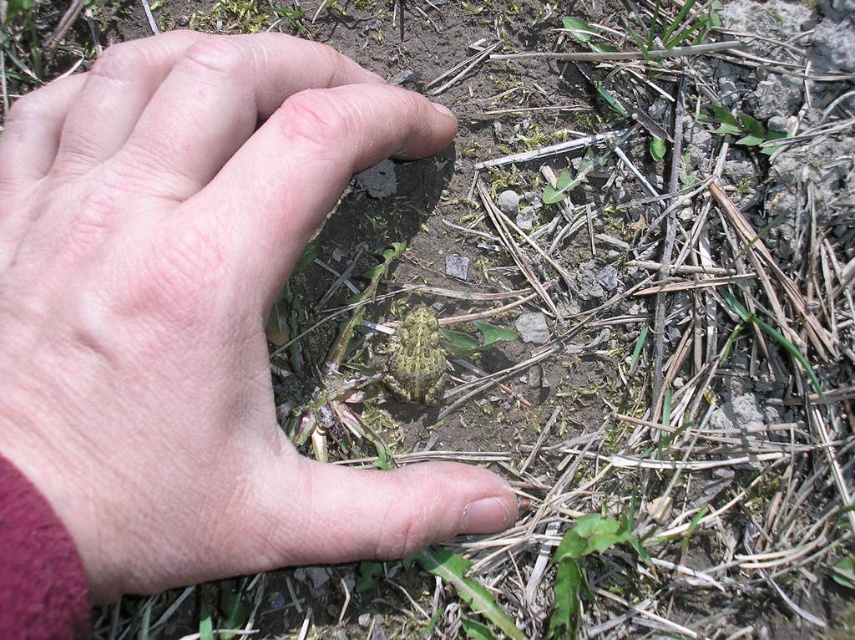
Question: Is pink flesh at center to the left of camouflage skin frog at center from the viewer's perspective?

Choices:
 (A) no
 (B) yes

Answer: (B)

Question: Which object appears farthest from the camera in this image?

Choices:
 (A) camouflage skin frog at center
 (B) pink flesh at center

Answer: (A)

Question: Which of the following is the closest to the observer?

Choices:
 (A) (381, 362)
 (B) (196, 198)

Answer: (B)

Question: Is pink flesh at center to the right of camouflage skin frog at center from the viewer's perspective?

Choices:
 (A) no
 (B) yes

Answer: (A)

Question: Is pink flesh at center bigger than camouflage skin frog at center?

Choices:
 (A) no
 (B) yes

Answer: (B)